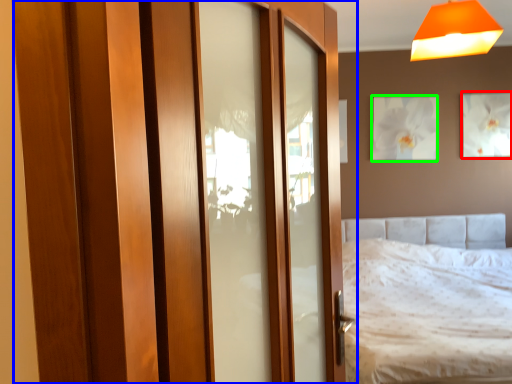
Question: Which is farther away from picture frame (highlighted by a red box)? door (highlighted by a blue box) or picture frame (highlighted by a green box)?

Choices:
 (A) door
 (B) picture frame

Answer: (A)